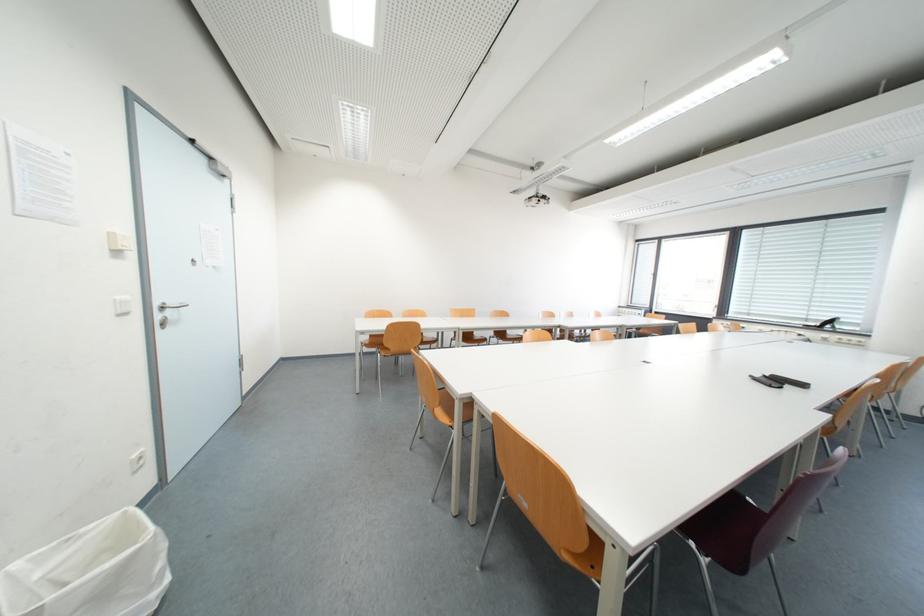
Identify the location of black remote control. This screenshot has width=924, height=616. (766, 381).